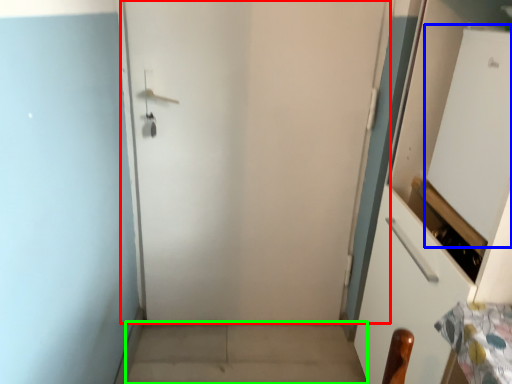
Question: Which object is positioned closest to door (highlighted by a red box)? Select from screen door (highlighted by a blue box) and concrete (highlighted by a green box).

Choices:
 (A) screen door
 (B) concrete

Answer: (B)